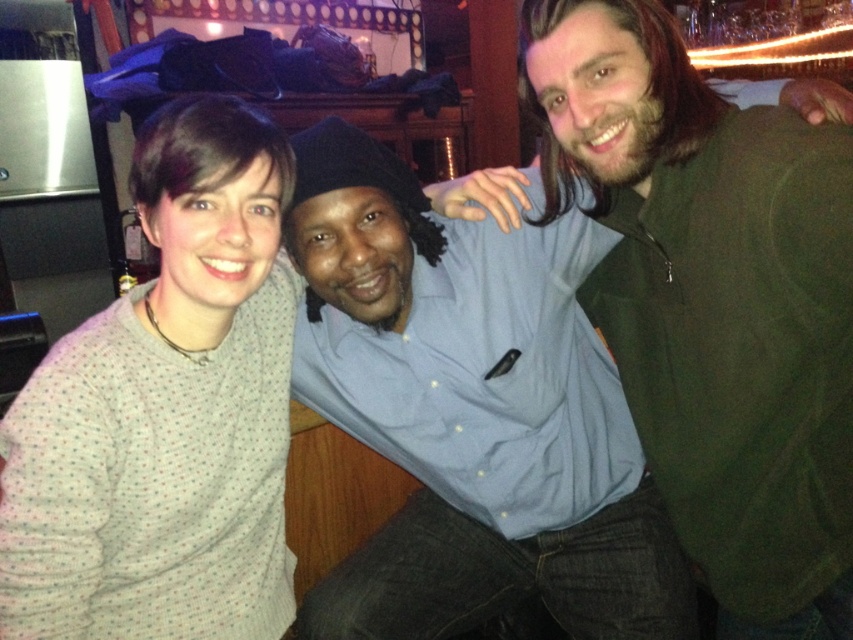
Question: Can you confirm if green matte jacket at right is positioned to the left of blue button-down shirt at center?

Choices:
 (A) no
 (B) yes

Answer: (A)

Question: Does green matte jacket at right appear on the left side of white dotted sweater at left?

Choices:
 (A) yes
 (B) no

Answer: (B)

Question: Which object is closer to the camera taking this photo?

Choices:
 (A) white dotted sweater at left
 (B) green matte jacket at right
 (C) blue button-down shirt at center

Answer: (B)

Question: Is green matte jacket at right below white dotted sweater at left?

Choices:
 (A) no
 (B) yes

Answer: (A)

Question: Which of the following is the closest to the observer?

Choices:
 (A) green matte jacket at right
 (B) blue button-down shirt at center
 (C) white dotted sweater at left

Answer: (A)

Question: Estimate the real-world distances between objects in this image. Which object is closer to the green matte jacket at right?

Choices:
 (A) white dotted sweater at left
 (B) blue button-down shirt at center

Answer: (B)